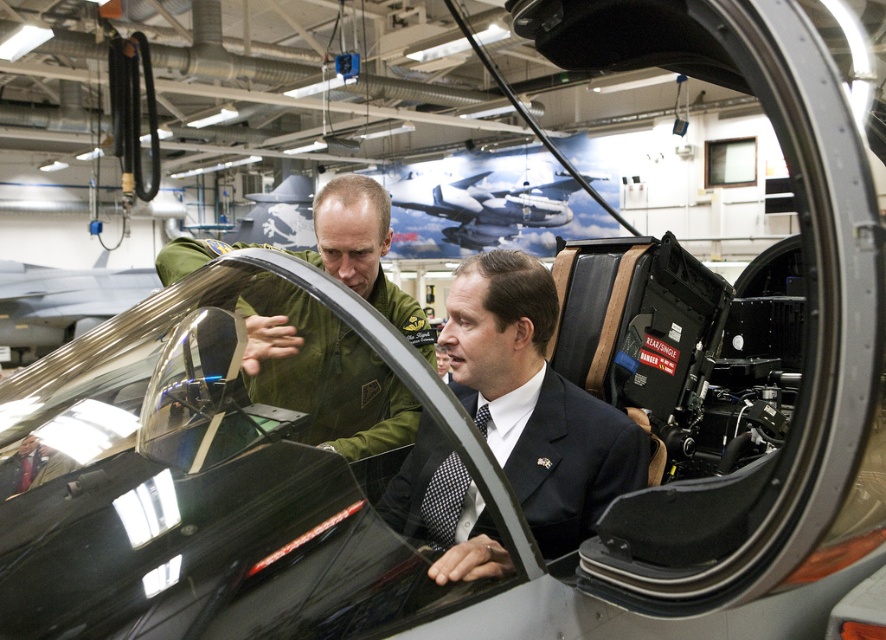
Can you confirm if dark green uniform at center is wider than metallic silver aircraft at center?

No, dark green uniform at center is not wider than metallic silver aircraft at center.

Identify the location of dark green uniform at center. The image size is (886, 640). (535, 401).

Who is positioned more to the left, dark green uniform at center or green uniform at center?

green uniform at center is more to the left.

Between dark green uniform at center and green uniform at center, which one has more height?

Standing taller between the two is green uniform at center.

Is point (531, 486) more distant than point (260, 397)?

Yes, point (531, 486) is behind point (260, 397).

Identify the location of dark green uniform at center. The width and height of the screenshot is (886, 640). (535, 401).

Is green uniform at center bigger than metallic silver aircraft at center?

No.

Is green uniform at center smaller than metallic silver aircraft at center?

Correct, green uniform at center occupies less space than metallic silver aircraft at center.

Is point (255, 381) closer to viewer compared to point (405, 200)?

Yes, point (255, 381) is closer to viewer.

The height and width of the screenshot is (640, 886). I want to click on green uniform at center, so click(x=323, y=372).